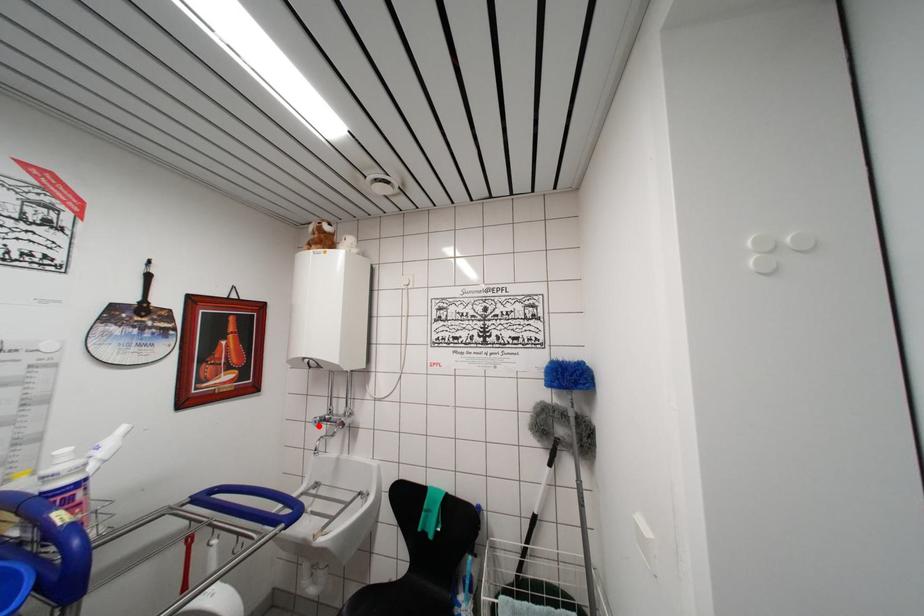
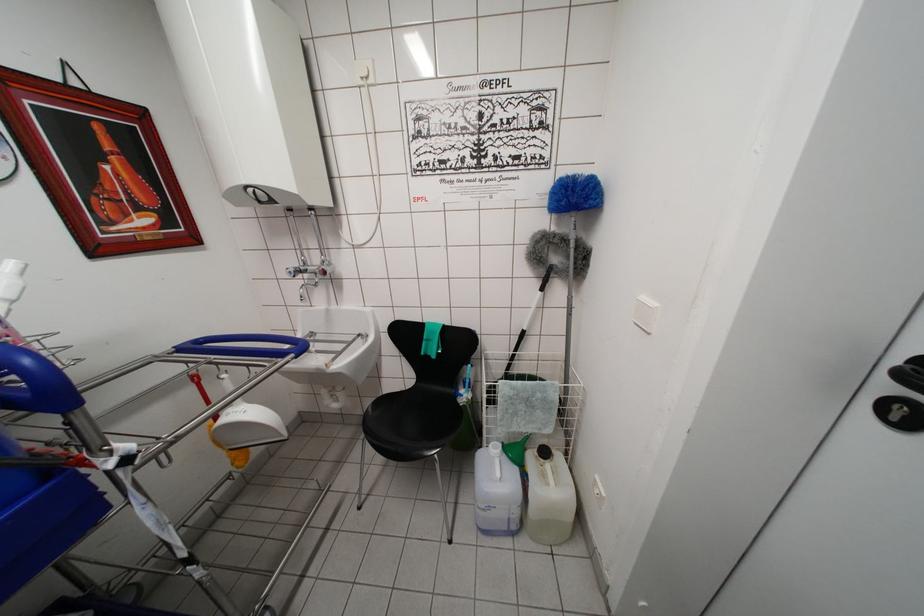
Question: I am providing you with two images of the same scene from different viewpoints. In image1, a red point is highlighted. Considering the same 3D point in image2, which of the following is correct?

Choices:
 (A) It is closer
 (B) It is farther

Answer: (A)